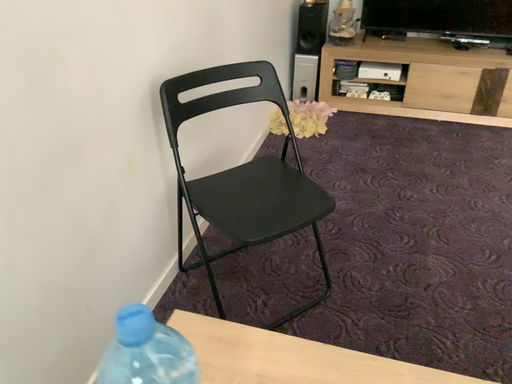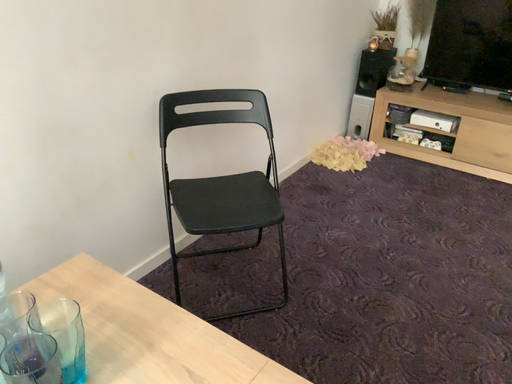
Question: How did the camera likely rotate when shooting the video?

Choices:
 (A) rotated left
 (B) rotated right

Answer: (A)